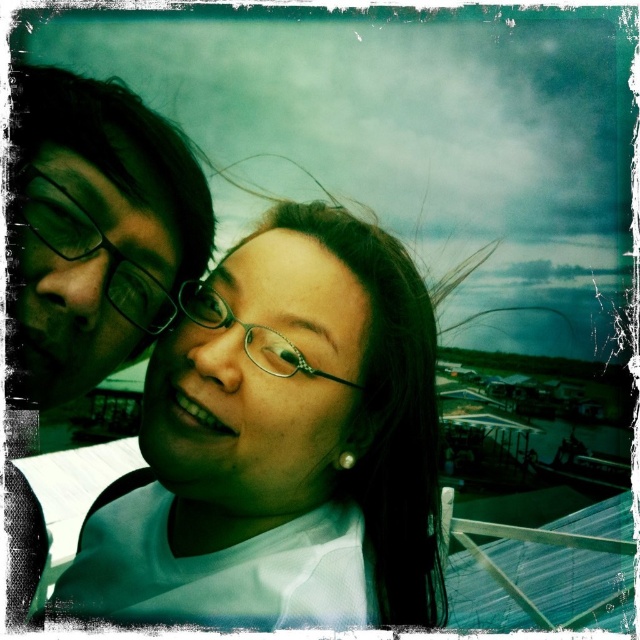
Question: Observing the image, what is the correct spatial positioning of white matte/soft fabric at center in reference to pearl earrings at center?

Choices:
 (A) below
 (B) above

Answer: (A)

Question: Which point is closer to the camera taking this photo?

Choices:
 (A) (340, 380)
 (B) (166, 278)
 (C) (356, 513)

Answer: (A)

Question: Estimate the real-world distances between objects in this image. Which object is farther from the pearl earrings at center?

Choices:
 (A) matte black glasses at upper left
 (B) clear plastic glasses at center
 (C) white matte/soft fabric at center

Answer: (A)

Question: Which object appears farthest from the camera in this image?

Choices:
 (A) white matte/soft fabric at center
 (B) clear plastic glasses at center

Answer: (B)

Question: Does pearl earrings at center appear on the right side of matte black glasses at upper left?

Choices:
 (A) no
 (B) yes

Answer: (B)

Question: Does pearl earrings at center have a larger size compared to clear plastic glasses at center?

Choices:
 (A) yes
 (B) no

Answer: (A)